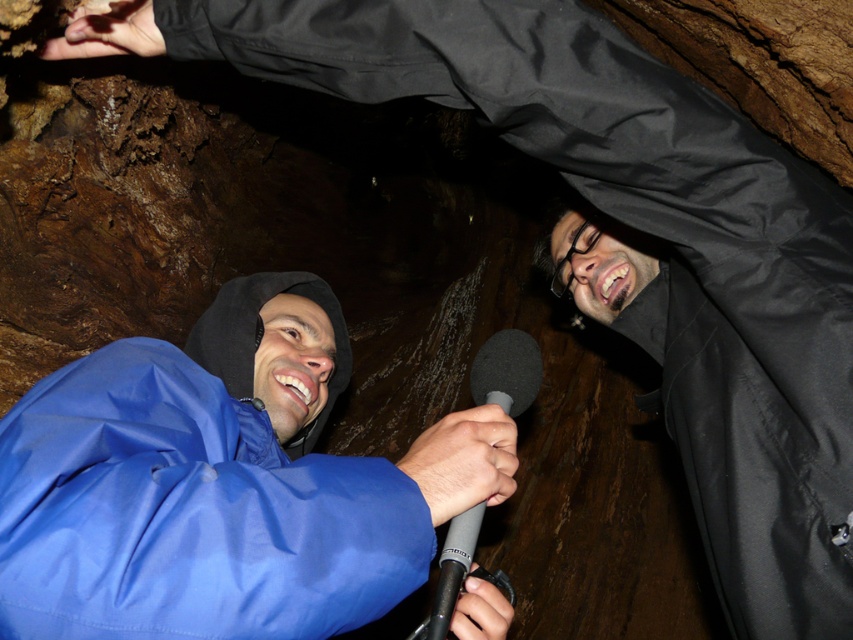
You are a photographer in the cave. You want to take a photo of the two people so that the blue waterproof jacket at center and the gray matte microphone at center are clearly visible in the frame. Considering their distance, will you need to adjust your camera settings for close focus mode?

The blue waterproof jacket at center is 22.57 centimeters from the gray matte microphone at center. Since close focus mode is typically used for subjects within 1 meter, the distance between them is sufficient for standard focus without needing close focus mode.

Based on the coordinates provided, which object is located at point [219,484]?

The blue waterproof jacket at center is located at point [219,484].